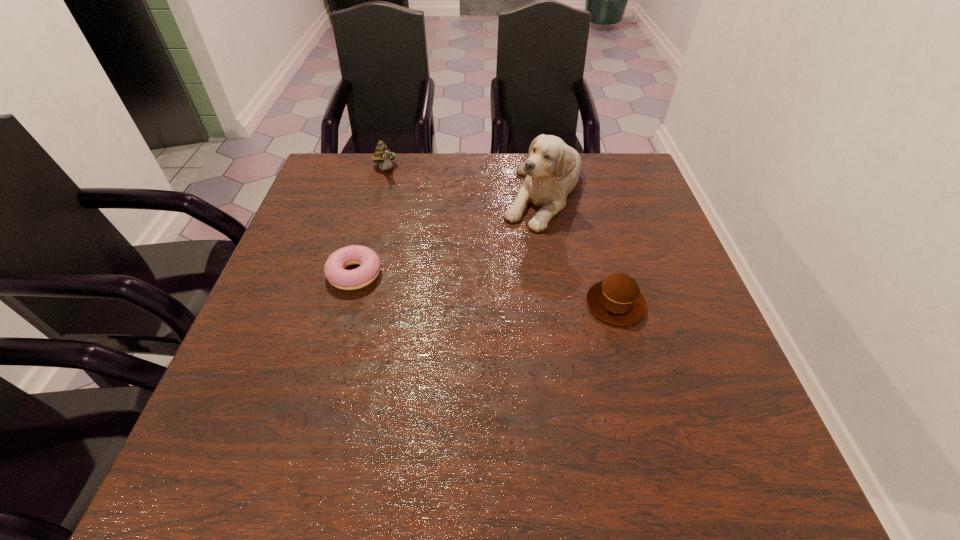
Locate an element on the screen. This screenshot has height=540, width=960. empty space that is in between the snail and the muffin is located at coordinates (501, 237).

Where is `vacant area between the doughnut and the tallest object`? vacant area between the doughnut and the tallest object is located at coordinates (449, 232).

The height and width of the screenshot is (540, 960). What are the coordinates of `blank region between the doughnut and the third shortest object` in the screenshot? It's located at (370, 222).

I want to click on vacant space that's between the muffin and the tallest object, so click(580, 247).

Find the location of a particular element. free space between the shortest object and the tallest object is located at coordinates (449, 232).

Locate which object is the third closest to the snail. Please provide its 2D coordinates. Your answer should be formatted as a tuple, i.e. [(x, y)], where the tuple contains the x and y coordinates of a point satisfying the conditions above.

[(617, 300)]

The image size is (960, 540). Find the location of `the second closest object to the shortest object`. the second closest object to the shortest object is located at coordinates (383, 155).

At what (x,y) coordinates should I click in order to perform the action: click on vacant space that satisfies the following two spatial constraints: 1. on the front side of the third tallest object; 2. on the left side of the doughnut. Please return your answer as a coordinate pair (x, y). Looking at the image, I should click on (347, 304).